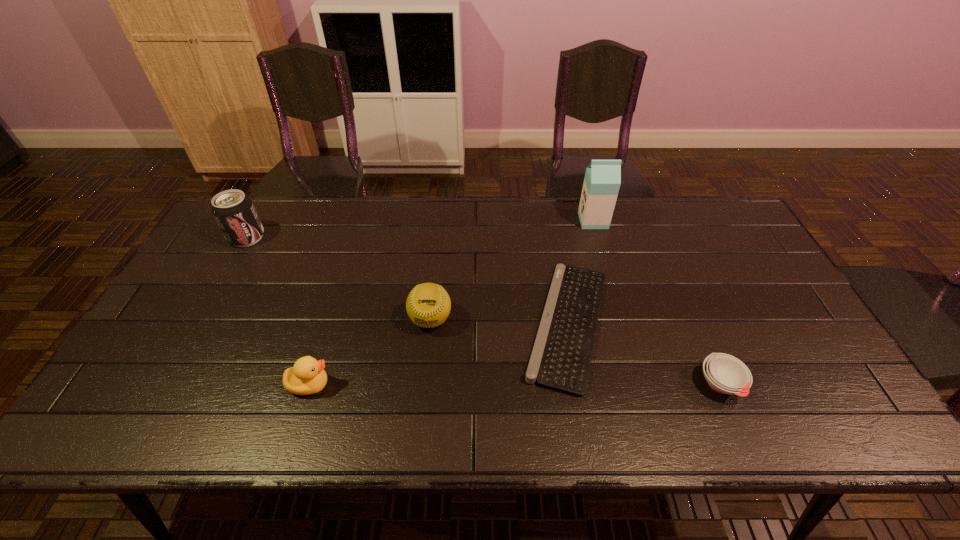
Locate an element on the screen. The width and height of the screenshot is (960, 540). object that is at the far left corner is located at coordinates (234, 212).

This screenshot has height=540, width=960. Find the location of `vacant space at the far edge of the desktop`. vacant space at the far edge of the desktop is located at coordinates (468, 232).

Where is `free space at the near edge`? The height and width of the screenshot is (540, 960). free space at the near edge is located at coordinates (258, 411).

At what (x,y) coordinates should I click in order to perform the action: click on free space at the left edge of the desktop. Please return your answer as a coordinate pair (x, y). The width and height of the screenshot is (960, 540). Looking at the image, I should click on (152, 385).

Identify the location of free space at the right edge of the desktop. (824, 360).

The width and height of the screenshot is (960, 540). In the image, there is a desktop. Identify the location of free region at the far right corner. (709, 239).

In the image, there is a desktop. Identify the location of free space at the near right corner. This screenshot has height=540, width=960. (786, 403).

This screenshot has height=540, width=960. I want to click on empty space between the tallest object and the fourth tallest object, so click(451, 302).

The height and width of the screenshot is (540, 960). I want to click on free spot between the leftmost object and the milk carton, so click(420, 229).

This screenshot has height=540, width=960. Identify the location of blank region between the soup bowl and the tallest object. (657, 302).